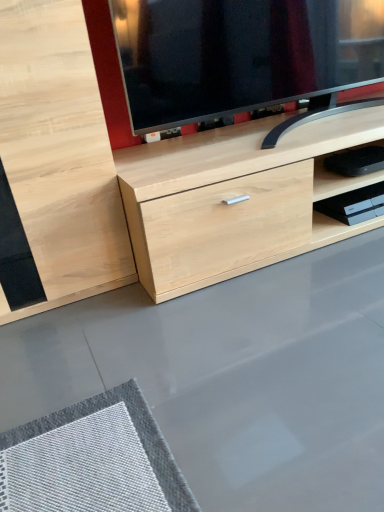
The image size is (384, 512). What do you see at coordinates (349, 213) in the screenshot?
I see `black plastic shelf at lower right` at bounding box center [349, 213].

This screenshot has height=512, width=384. Find the location of `black plastic shelf at lower right`. black plastic shelf at lower right is located at coordinates (349, 213).

Find the location of a particular element. This screenshot has height=512, width=384. black plastic device at lower right is located at coordinates (356, 161).

From the picture: What is the approximate height of black plastic device at lower right?

black plastic device at lower right is 2.39 inches in height.

The height and width of the screenshot is (512, 384). Describe the element at coordinates (356, 161) in the screenshot. I see `black plastic device at lower right` at that location.

Find the location of a particular element. This screenshot has height=512, width=384. black plastic shelf at lower right is located at coordinates (349, 213).

Visually, is black plastic shelf at lower right positioned to the left or to the right of black plastic device at lower right?

In the image, black plastic shelf at lower right appears on the right side of black plastic device at lower right.

Is black plastic shelf at lower right positioned in front of black plastic device at lower right?

No.

Which is less distant, (315,234) or (356,151)?

The point (315,234) is closer to the camera.

From the image's perspective, which one is positioned higher, black plastic shelf at lower right or black plastic device at lower right?

black plastic device at lower right, from the image's perspective.

From a real-world perspective, who is located lower, black plastic shelf at lower right or black plastic device at lower right?

black plastic shelf at lower right, from a real-world perspective.

In terms of width, does black plastic shelf at lower right look wider or thinner when compared to black plastic device at lower right?

In the image, black plastic shelf at lower right appears to be more narrow than black plastic device at lower right.

Does black plastic shelf at lower right have a lesser height compared to black plastic device at lower right?

Yes.

Looking at the image, does black plastic shelf at lower right seem bigger or smaller compared to black plastic device at lower right?

Clearly, black plastic shelf at lower right is smaller in size than black plastic device at lower right.

Do you think black plastic shelf at lower right is within black plastic device at lower right, or outside of it?

black plastic shelf at lower right exists outside the volume of black plastic device at lower right.

Is black plastic shelf at lower right in contact with black plastic device at lower right?

No, black plastic shelf at lower right is not touching black plastic device at lower right.

Is black plastic shelf at lower right oriented towards black plastic device at lower right?

No, black plastic shelf at lower right is not oriented towards black plastic device at lower right.

How different are the orientations of black plastic shelf at lower right and black plastic device at lower right in degrees?

0.251 degrees separate the facing orientations of black plastic shelf at lower right and black plastic device at lower right.

Identify the location of equipment located above the black plastic shelf at lower right (from the image's perspective). This screenshot has width=384, height=512. (356, 161).

Is black plastic device at lower right to the left or to the right of black plastic shelf at lower right in the image?

black plastic device at lower right is to the left of black plastic shelf at lower right.

Between black plastic device at lower right and black plastic shelf at lower right, which one is positioned in front?

black plastic device at lower right.

Is point (344, 158) closer or farther from the camera than point (356, 226)?

Point (344, 158) is closer to the camera than point (356, 226).

From the image's perspective, which one is positioned higher, black plastic device at lower right or black plastic shelf at lower right?

From the image's view, black plastic device at lower right is above.

From a real-world perspective, is black plastic device at lower right on top of black plastic shelf at lower right?

Yes, from a real-world perspective, black plastic device at lower right is above black plastic shelf at lower right.

Which of these two, black plastic device at lower right or black plastic shelf at lower right, is thinner?

With smaller width is black plastic shelf at lower right.

From their relative heights in the image, would you say black plastic device at lower right is taller or shorter than black plastic shelf at lower right?

Clearly, black plastic device at lower right is taller compared to black plastic shelf at lower right.

Can you confirm if black plastic device at lower right is smaller than black plastic shelf at lower right?

Actually, black plastic device at lower right might be larger than black plastic shelf at lower right.

Is black plastic device at lower right completely or partially outside of black plastic shelf at lower right?

Yes, black plastic device at lower right is not within black plastic shelf at lower right.

Consider the image. Is black plastic device at lower right touching black plastic shelf at lower right?

black plastic device at lower right and black plastic shelf at lower right are clearly separated.

Could you tell me if black plastic device at lower right is facing black plastic shelf at lower right?

No, black plastic device at lower right is not oriented towards black plastic shelf at lower right.

Image resolution: width=384 pixels, height=512 pixels. I want to click on shelf that appears on the right of black plastic device at lower right, so click(349, 213).

This screenshot has width=384, height=512. Identify the location of shelf that appears below the black plastic device at lower right (from the image's perspective). (349, 213).

Locate an element on the screen. The height and width of the screenshot is (512, 384). equipment above the black plastic shelf at lower right (from a real-world perspective) is located at coordinates (356, 161).